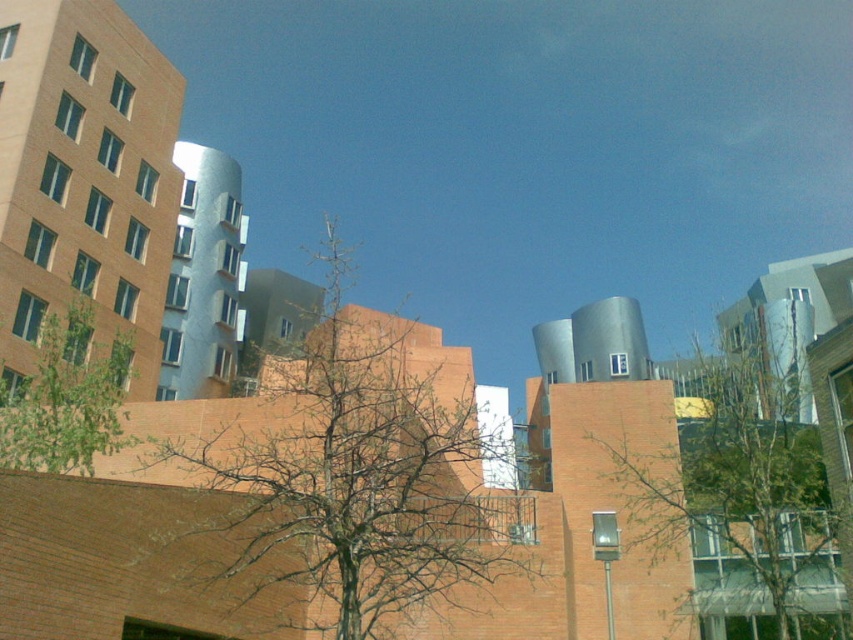
Question: Does bare branches at center appear on the left side of green leafy tree at center?

Choices:
 (A) yes
 (B) no

Answer: (A)

Question: Which object is the farthest from the bare branches at center?

Choices:
 (A) green leafy tree at center
 (B) green leafy tree at left

Answer: (A)

Question: Which object is closer to the camera taking this photo?

Choices:
 (A) green leafy tree at center
 (B) bare branches at center

Answer: (B)

Question: In this image, where is bare branches at center located relative to green leafy tree at center?

Choices:
 (A) below
 (B) above

Answer: (B)

Question: Is bare branches at center further to the viewer compared to green leafy tree at left?

Choices:
 (A) no
 (B) yes

Answer: (A)

Question: Which of the following is the closest to the observer?

Choices:
 (A) (91, 442)
 (B) (373, 630)
 (C) (753, 368)

Answer: (B)